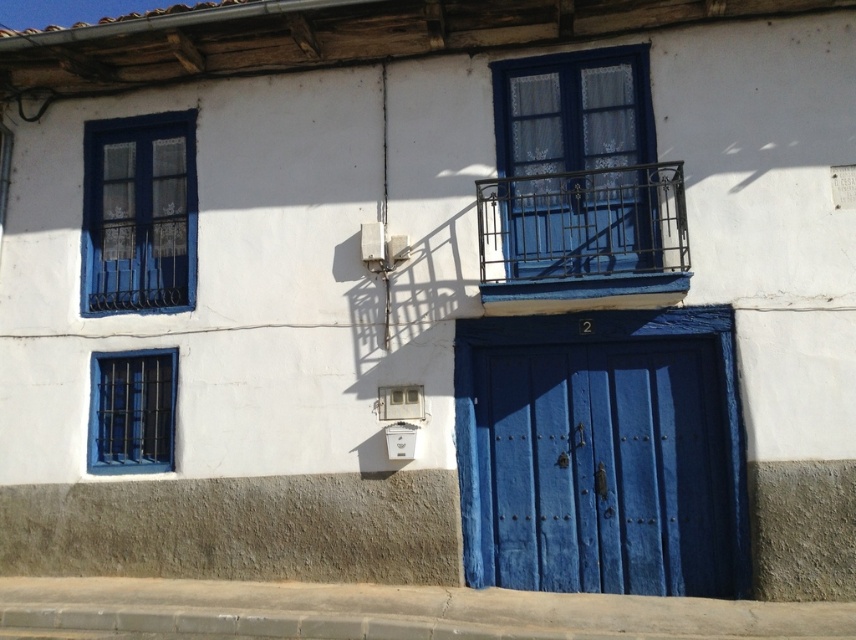
You are an architect designing a new building inspired by the Mediterranean style. You need to ensure that the metallic blue balcony at center and the matte blue window at lower left are proportionally balanced. Given their widths, which element should be placed in a position that requires more visual weight?

The metallic blue balcony at center should be placed in a position requiring more visual weight since its width surpasses that of the matte blue window at lower left, making it a more dominant feature.

You are standing in front of the two story building and want to locate the matte blue window at upper left and the matte blue window at lower left. Which one is positioned further to the left side of the building?

The matte blue window at upper left is positioned further to the left side of the building than the matte blue window at lower left.